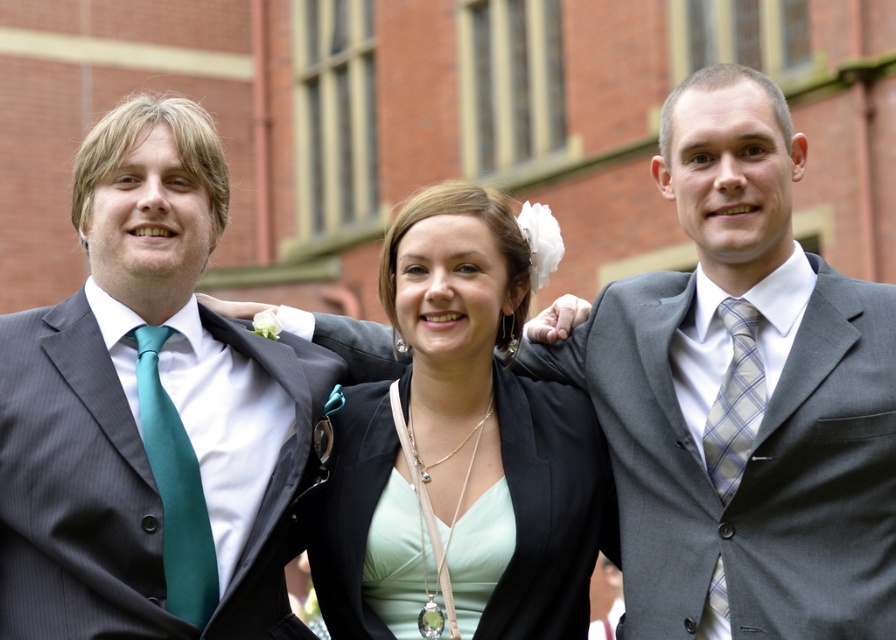
You are standing at the point marked as point (356, 577) and want to take a photo of the three people in the scene. If you move 10 meters closer to them, will you be able to see all three people in the frame?

The point (356, 577) is 32.87 meters away from the viewer. Moving 10 meters closer would place you at 22.87 meters away. Since the three people are standing closely together, you would still be able to see all three in the frame at this distance.

You are a photographer trying to capture a closeup of the matte black blazer at center. The camera you are using has a focal length of 50mm. To ensure the blazer fills the frame, you need to position yourself exactly at point (462, 448). Can you confirm the coordinates of the matte black blazer at center?

The matte black blazer at center is located at point (462, 448).